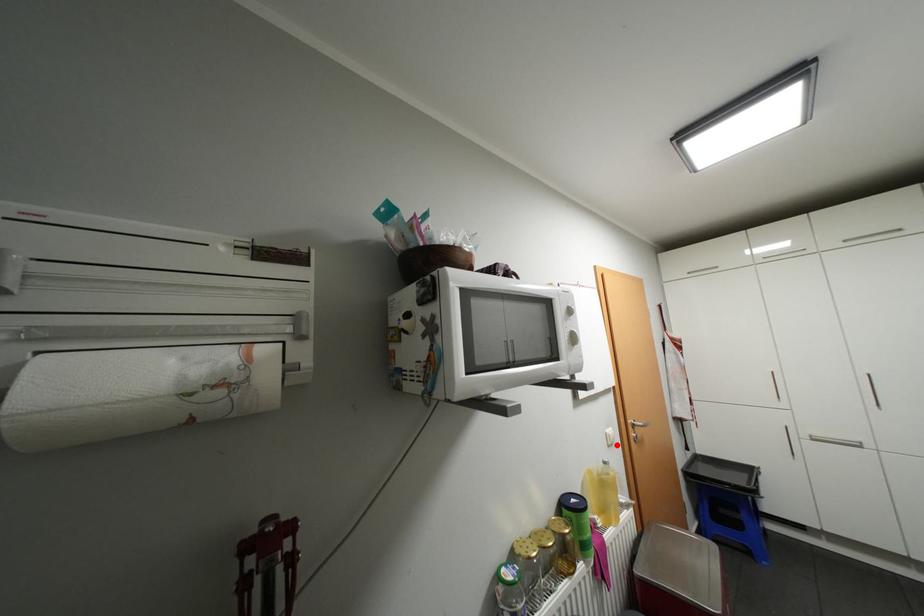
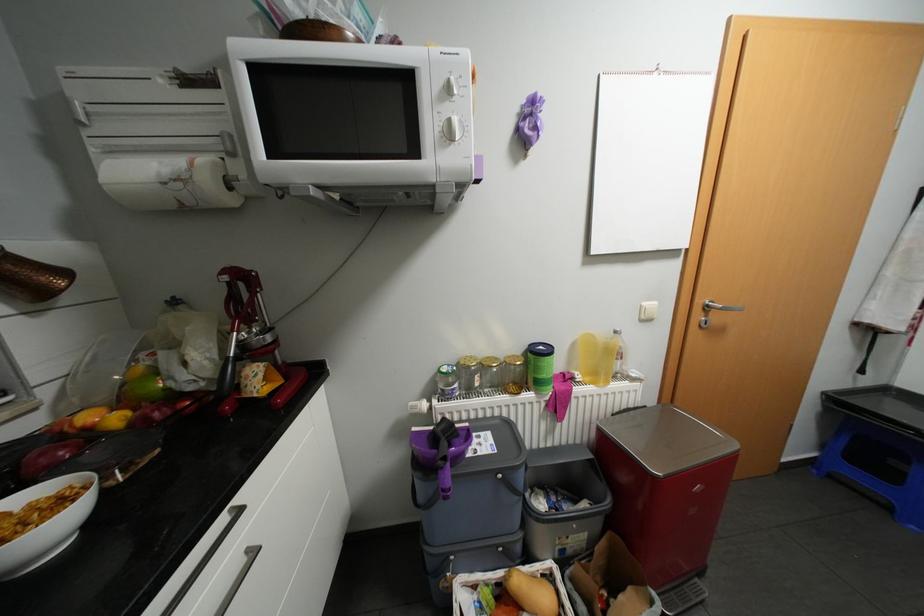
In the second image, find the point that corresponds to the highlighted location in the first image.

(649, 320)